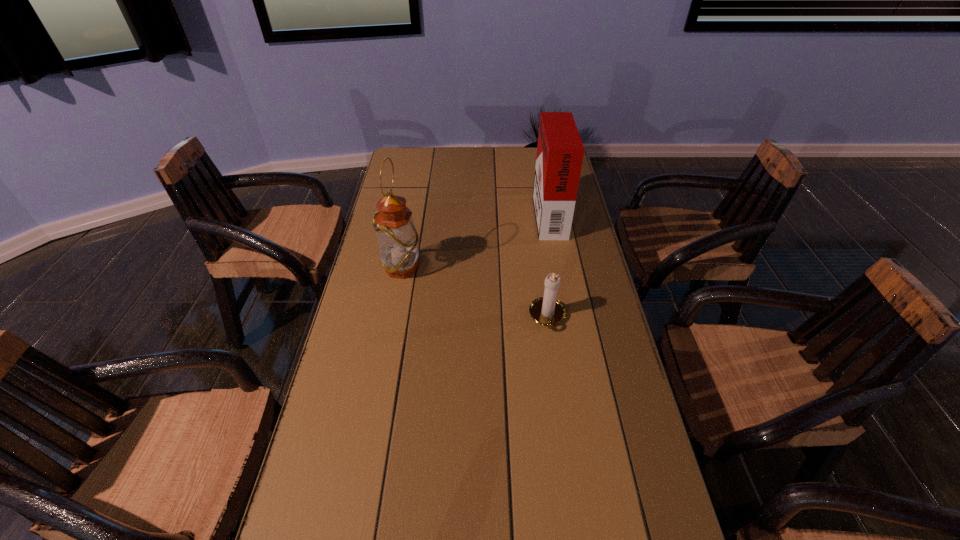
Where is `vacant space that's between the candle holder and the leftmost object`? Image resolution: width=960 pixels, height=540 pixels. vacant space that's between the candle holder and the leftmost object is located at coordinates (475, 293).

Where is `vacant area between the farthest object and the shortest object`? Image resolution: width=960 pixels, height=540 pixels. vacant area between the farthest object and the shortest object is located at coordinates (548, 265).

This screenshot has height=540, width=960. I want to click on object that can be found as the second closest to the candle holder, so click(397, 238).

Choose which object is the nearest neighbor to the farthest object. Please provide its 2D coordinates. Your answer should be formatted as a tuple, i.e. [(x, y)], where the tuple contains the x and y coordinates of a point satisfying the conditions above.

[(548, 311)]

Identify the location of vacant space that satisfies the following two spatial constraints: 1. on the front-facing side of the farthest object; 2. on the handle side of the candle holder. [x=568, y=316].

Where is `vacant position in the image that satisfies the following two spatial constraints: 1. on the front-facing side of the cigarette case; 2. on the handle side of the nearest object`? vacant position in the image that satisfies the following two spatial constraints: 1. on the front-facing side of the cigarette case; 2. on the handle side of the nearest object is located at coordinates (568, 316).